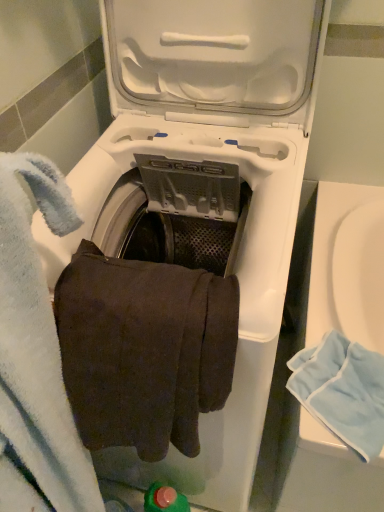
Question: From the image's perspective, does brown cotton towel at center, the first bath towel viewed from the left, appear lower than light blue cotton towel at lower right, which is the first bath towel from right to left?

Choices:
 (A) no
 (B) yes

Answer: (A)

Question: Does brown cotton towel at center, the first bath towel viewed from the left, have a lesser width compared to light blue cotton towel at lower right, which ranks as the second bath towel in left-to-right order?

Choices:
 (A) yes
 (B) no

Answer: (A)

Question: Is brown cotton towel at center, the 2th bath towel positioned from the right, next to light blue cotton towel at lower right, which is the first bath towel from right to left?

Choices:
 (A) yes
 (B) no

Answer: (B)

Question: Does brown cotton towel at center, the first bath towel viewed from the left, have a greater height compared to light blue cotton towel at lower right, which is the first bath towel from right to left?

Choices:
 (A) no
 (B) yes

Answer: (B)

Question: From a real-world perspective, is brown cotton towel at center, the 2th bath towel positioned from the right, under light blue cotton towel at lower right, which is the first bath towel from right to left?

Choices:
 (A) no
 (B) yes

Answer: (A)

Question: Does brown cotton towel at center, the 2th bath towel positioned from the right, have a smaller size compared to light blue cotton towel at lower right, which ranks as the second bath towel in left-to-right order?

Choices:
 (A) no
 (B) yes

Answer: (A)

Question: Is there a large distance between light blue cotton towel at lower right, which is the first bath towel from right to left, and brown cotton towel at center, the 2th bath towel positioned from the right?

Choices:
 (A) yes
 (B) no

Answer: (B)

Question: Is brown cotton towel at center, the 2th bath towel positioned from the right, a part of light blue cotton towel at lower right, which is the first bath towel from right to left?

Choices:
 (A) no
 (B) yes

Answer: (A)

Question: Is the surface of light blue cotton towel at lower right, which is the first bath towel from right to left, in direct contact with brown cotton towel at center, the 2th bath towel positioned from the right?

Choices:
 (A) yes
 (B) no

Answer: (B)

Question: Is light blue cotton towel at lower right, which is the first bath towel from right to left, looking in the opposite direction of brown cotton towel at center, the first bath towel viewed from the left?

Choices:
 (A) no
 (B) yes

Answer: (A)

Question: Does light blue cotton towel at lower right, which ranks as the second bath towel in left-to-right order, come in front of brown cotton towel at center, the 2th bath towel positioned from the right?

Choices:
 (A) yes
 (B) no

Answer: (B)

Question: Is light blue cotton towel at lower right, which ranks as the second bath towel in left-to-right order, shorter than brown cotton towel at center, the first bath towel viewed from the left?

Choices:
 (A) no
 (B) yes

Answer: (B)

Question: Do you think light blue cotton towel at lower right, which is the first bath towel from right to left, is within brown cotton towel at center, the 2th bath towel positioned from the right, or outside of it?

Choices:
 (A) outside
 (B) inside

Answer: (A)